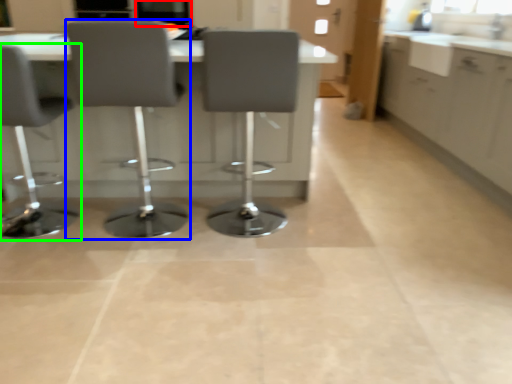
Question: Estimate the real-world distances between objects in this image. Which object is farther from window screen (highlighted by a red box), chair (highlighted by a blue box) or chair (highlighted by a green box)?

Choices:
 (A) chair
 (B) chair

Answer: (A)